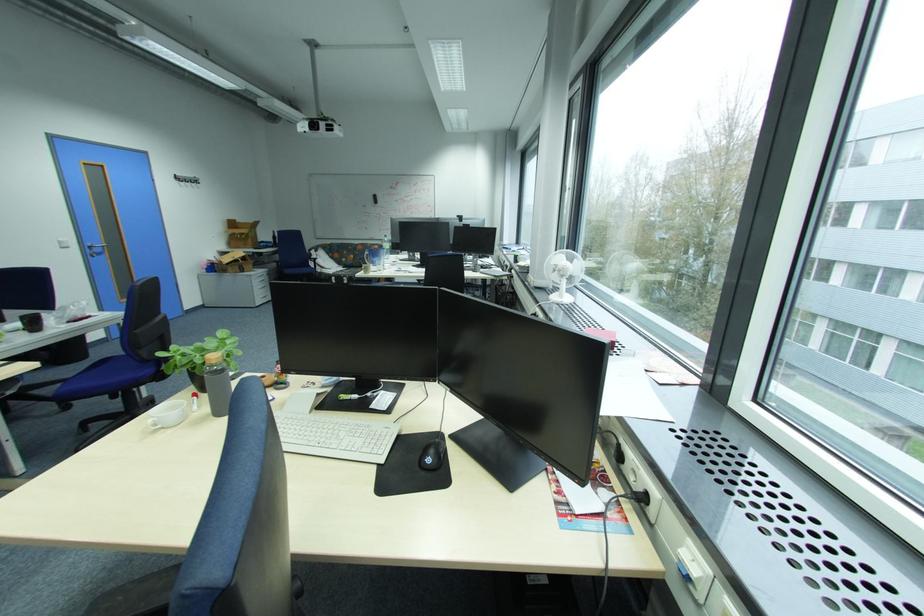
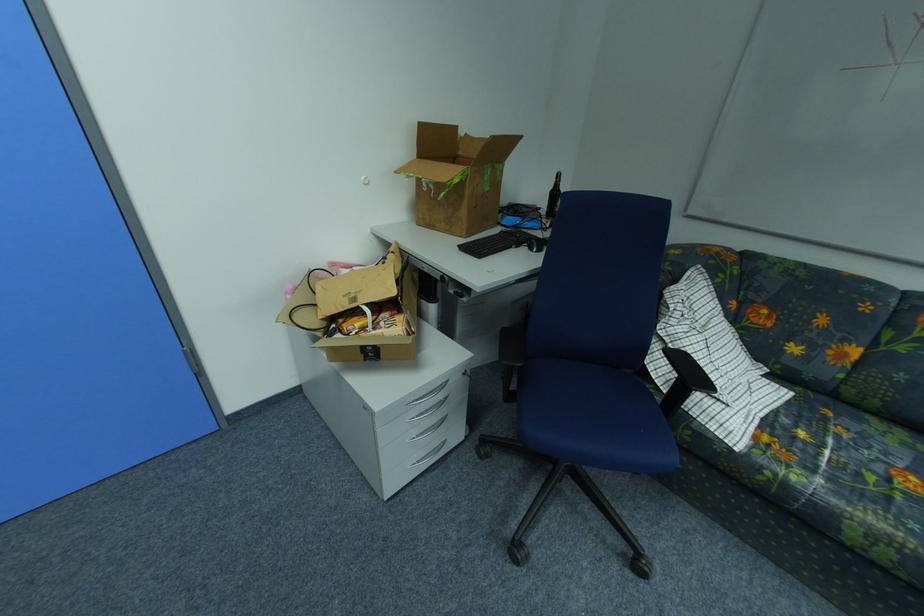
The point at (282, 237) is marked in the first image. Where is the corresponding point in the second image?

(560, 188)